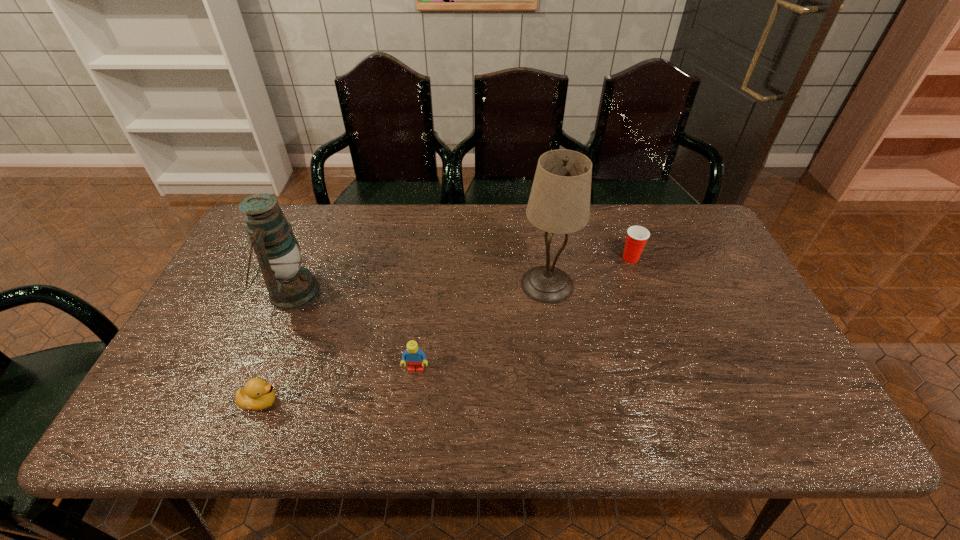
Where is `vacant space located 0.340m on the right of the oil lamp`? This screenshot has height=540, width=960. vacant space located 0.340m on the right of the oil lamp is located at coordinates (439, 293).

Identify the location of vacant space situated 0.340m on the left of the farthest object. (509, 258).

This screenshot has width=960, height=540. Identify the location of vacant space located on the face of the third object from left to right. [413, 393].

Where is `vacant region located facing forward on the nearest object`? The image size is (960, 540). vacant region located facing forward on the nearest object is located at coordinates (438, 402).

The width and height of the screenshot is (960, 540). I want to click on object that is at the near edge, so point(256,395).

Locate an element on the screen. This screenshot has width=960, height=540. object present at the left edge is located at coordinates (291, 286).

The width and height of the screenshot is (960, 540). I want to click on vacant space at the far edge of the desktop, so click(341, 234).

Find the location of a particular element. Image resolution: width=960 pixels, height=540 pixels. free space at the near edge is located at coordinates (607, 423).

Where is `vacant region at the left edge`? The height and width of the screenshot is (540, 960). vacant region at the left edge is located at coordinates (213, 400).

Where is `free space at the right edge of the desktop`? The image size is (960, 540). free space at the right edge of the desktop is located at coordinates (739, 279).